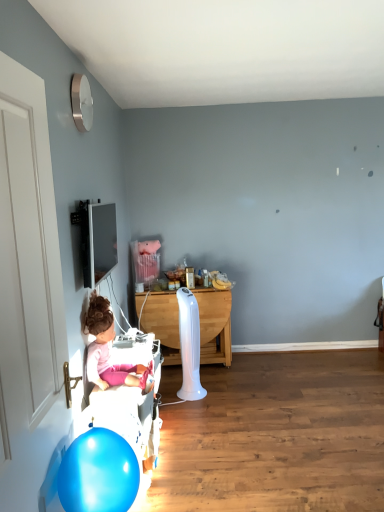
Question: Can you confirm if white wood table at center is positioned to the right of white fabric bed frame at lower left?

Choices:
 (A) no
 (B) yes

Answer: (B)

Question: Does white wood table at center have a larger size compared to white fabric bed frame at lower left?

Choices:
 (A) no
 (B) yes

Answer: (B)

Question: Is white fabric bed frame at lower left surrounded by white wood table at center?

Choices:
 (A) yes
 (B) no

Answer: (B)

Question: From the image's perspective, does white wood table at center appear higher than white fabric bed frame at lower left?

Choices:
 (A) yes
 (B) no

Answer: (A)

Question: Are white wood table at center and white fabric bed frame at lower left located far from each other?

Choices:
 (A) no
 (B) yes

Answer: (A)

Question: Can you confirm if white wood table at center is taller than white fabric bed frame at lower left?

Choices:
 (A) no
 (B) yes

Answer: (B)

Question: From the image's perspective, is pink fabric doll at lower left under white fabric bed frame at lower left?

Choices:
 (A) no
 (B) yes

Answer: (A)

Question: Is the depth of pink fabric doll at lower left greater than that of white fabric bed frame at lower left?

Choices:
 (A) yes
 (B) no

Answer: (B)

Question: Does pink fabric doll at lower left touch white fabric bed frame at lower left?

Choices:
 (A) no
 (B) yes

Answer: (A)

Question: From a real-world perspective, does pink fabric doll at lower left sit lower than white fabric bed frame at lower left?

Choices:
 (A) no
 (B) yes

Answer: (A)

Question: Is pink fabric doll at lower left positioned before white fabric bed frame at lower left?

Choices:
 (A) no
 (B) yes

Answer: (B)

Question: From the image's perspective, is pink fabric doll at lower left located above white fabric bed frame at lower left?

Choices:
 (A) yes
 (B) no

Answer: (A)

Question: Can you confirm if pink fabric doll at lower left is positioned to the left of blue glossy balloon at lower left?

Choices:
 (A) yes
 (B) no

Answer: (A)